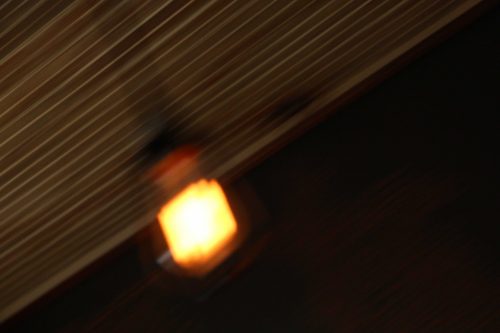
Locate an element on the screen. This screenshot has height=333, width=500. light is located at coordinates (191, 222).